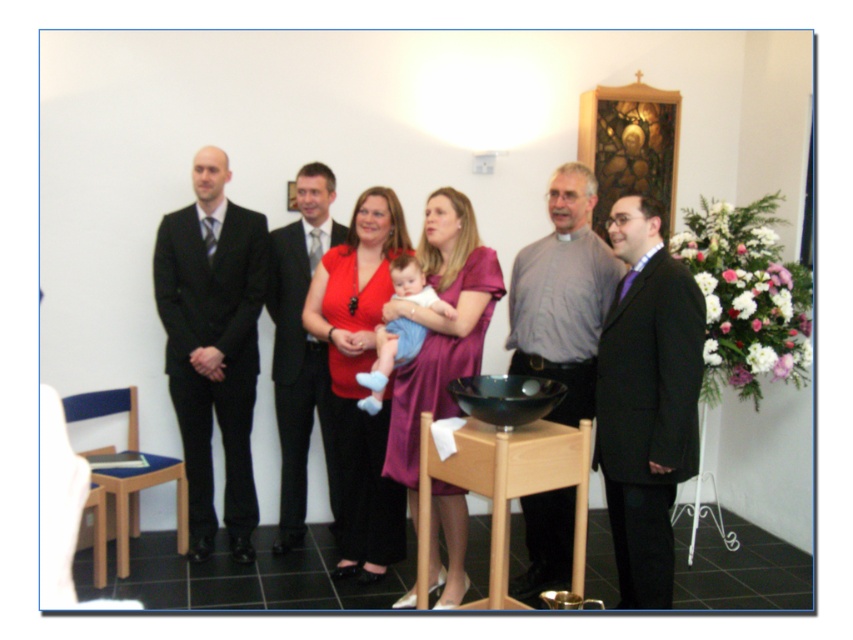
You are a photographer at the event and need to position your camera to capture both the shiny black suit at center and the light blue fabric baby at center in the same frame. Based on their positions, where should you aim the camera to include both?

You should aim the camera upwards to include both the shiny black suit at center and the light blue fabric baby at center since the shiny black suit at center is below the light blue fabric baby at center.

You are a photographer at a formal event. You need to position a camera stand between the matte black suit at center and the matte red dress at center. The camera stand requires 4 inches of space to fit. Can you fit it between them?

The distance between the matte black suit at center and the matte red dress at center is 3.97 inches, which is less than the required 4 inches. Therefore, the camera stand cannot be placed between them.